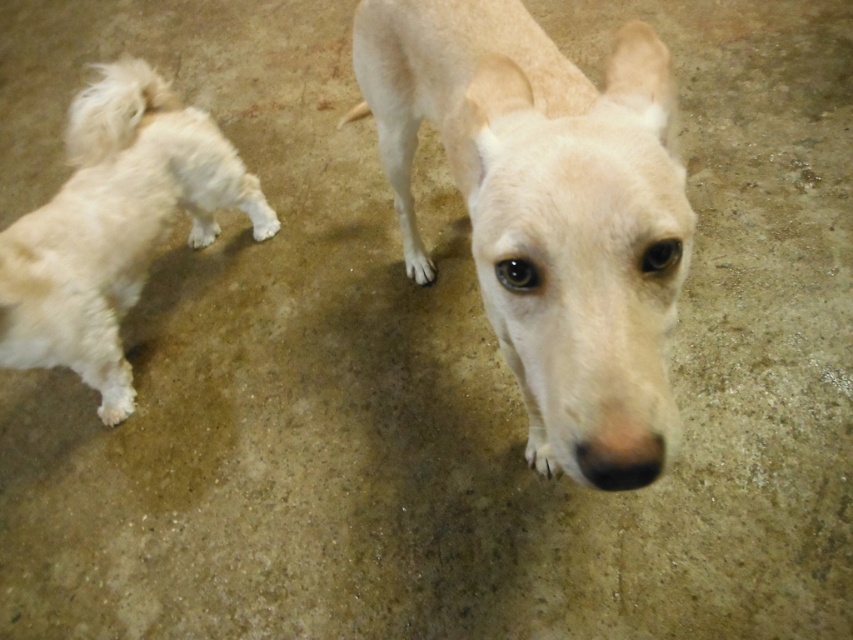
Between light beige fur dog at center and white fluffy dog at left, which one appears on the left side from the viewer's perspective?

white fluffy dog at left is more to the left.

Can you confirm if light beige fur dog at center is bigger than white fluffy dog at left?

Yes.

In order to click on light beige fur dog at center in this screenshot , I will do `click(547, 212)`.